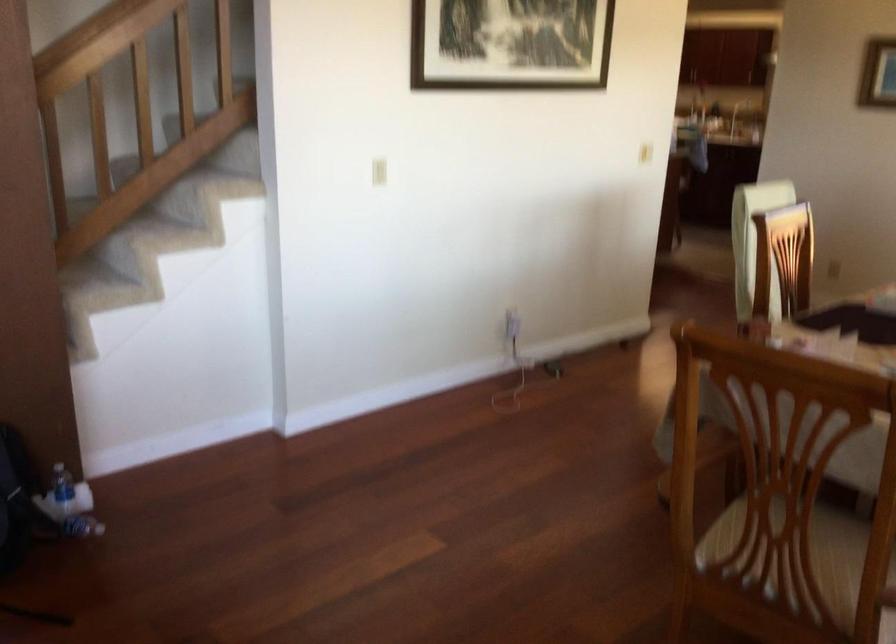
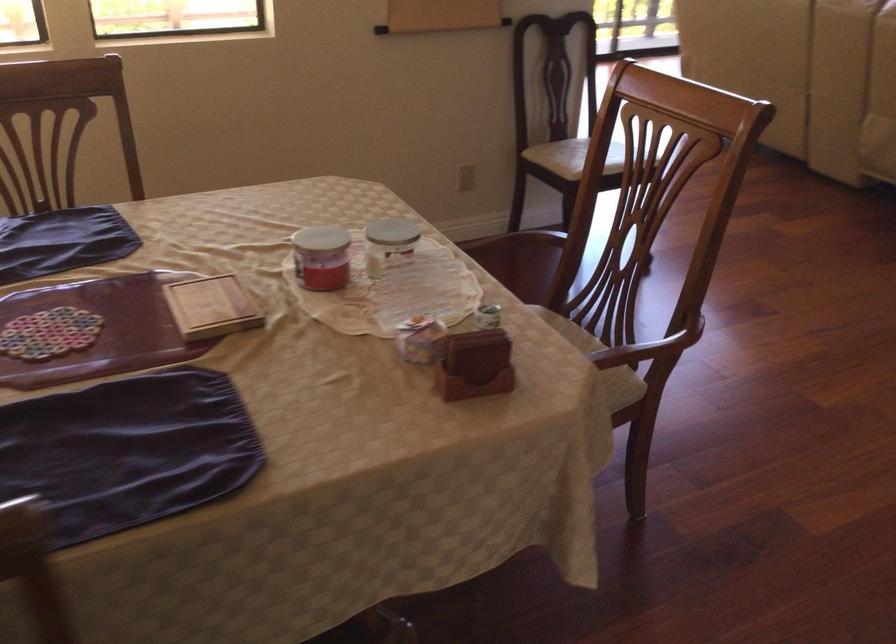
Find the pixel in the second image that matches pixel 688 458 in the first image.

(642, 351)